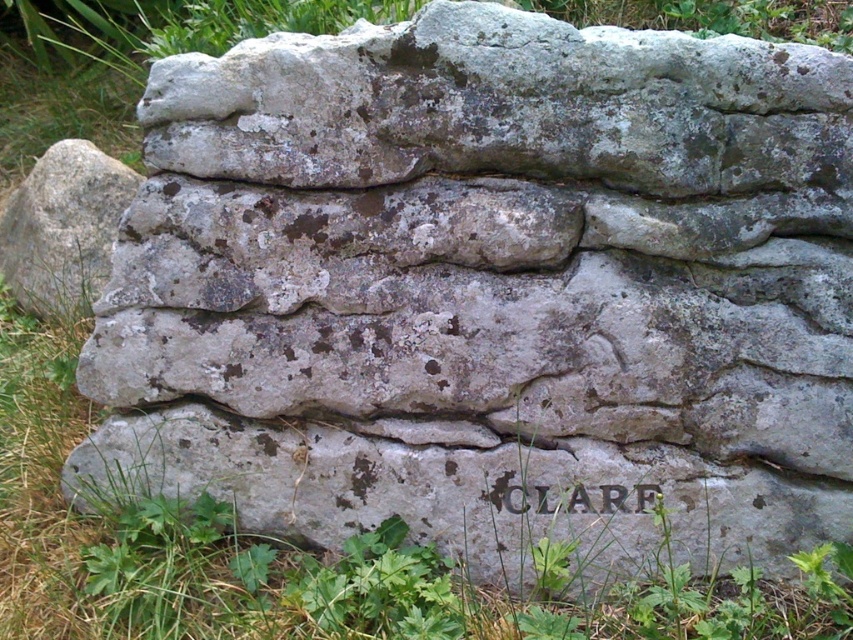
You are an archaeologist examining a stone wall with two marked points. You need to determine which point is closer to you. The points are labeled as point (80,300) and point (660,497). Based on the scene description, which point is closer to you?

Point (80,300) is closer to you because it is further to the viewer than point (660,497).

Consider the image. You are an architect examining a stone wall. You notice the gray rough stone at left and the carved stone lettering at center. Which object has a greater width?

The gray rough stone at left has a greater width than the carved stone lettering at center.